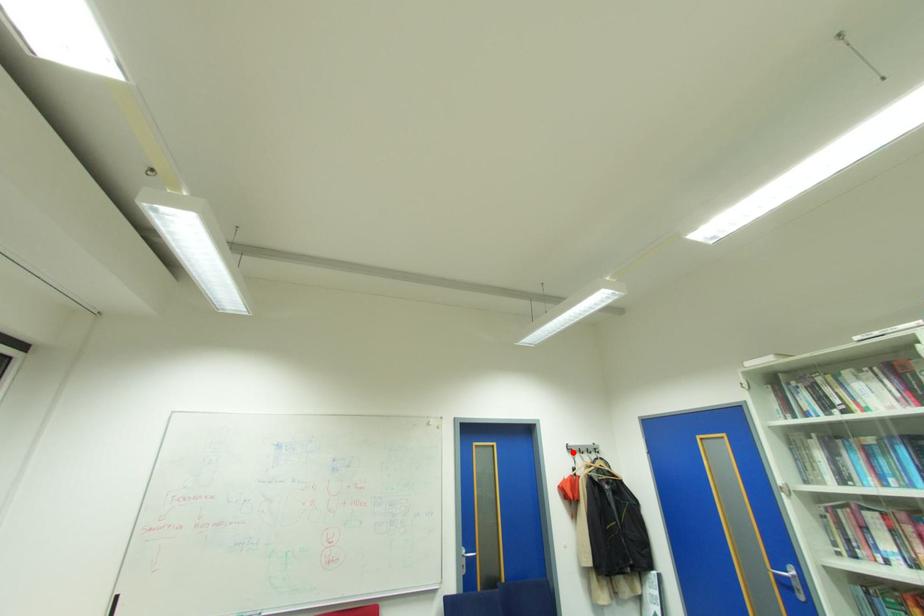
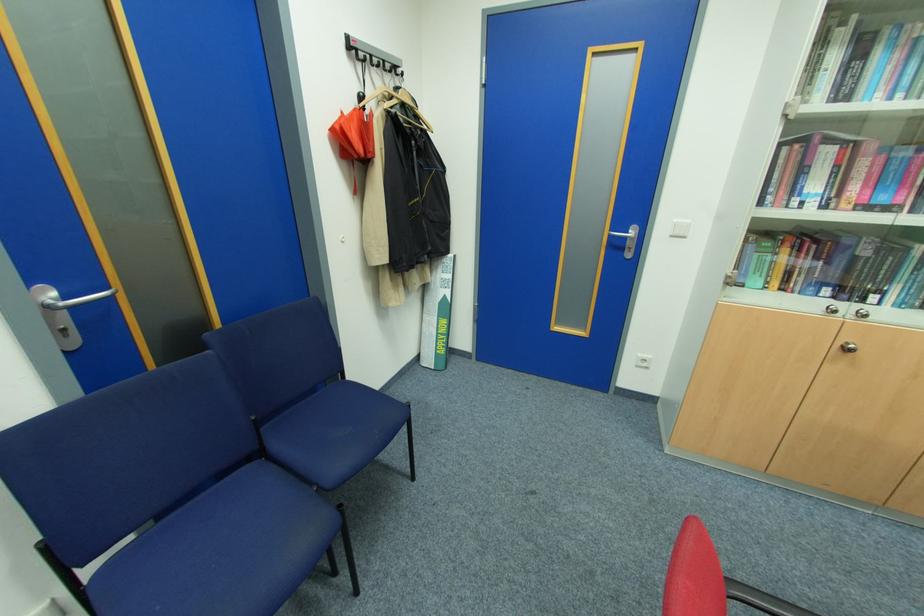
In the second image, find the point that corresponds to the highlighted location in the first image.

(353, 55)